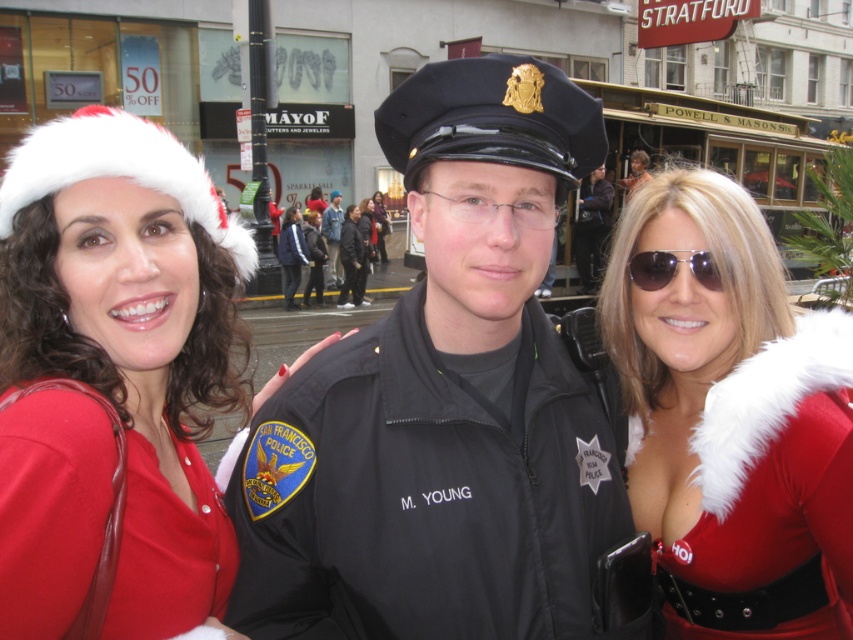
Question: Which point is closer to the camera?

Choices:
 (A) matte red dress at center
 (B) black matte uniform at center
 (C) matte black uniform at center

Answer: (A)

Question: Is dark blue uniform at center positioned in front of shiny silver hair at center?

Choices:
 (A) yes
 (B) no

Answer: (B)

Question: Among these objects, which one is farthest from the camera?

Choices:
 (A) matte black uniform at center
 (B) fuzzy white fur at right
 (C) matte red dress at center
 (D) shiny silver hair at center

Answer: (A)

Question: Which object is farther from the camera taking this photo?

Choices:
 (A) black matte uniform at center
 (B) matte red uniform at center

Answer: (A)

Question: Is white fuzzy santa hat at left to the right of black uniform at center from the viewer's perspective?

Choices:
 (A) no
 (B) yes

Answer: (A)

Question: Does matte red dress at center appear over matte black uniform at center?

Choices:
 (A) no
 (B) yes

Answer: (A)